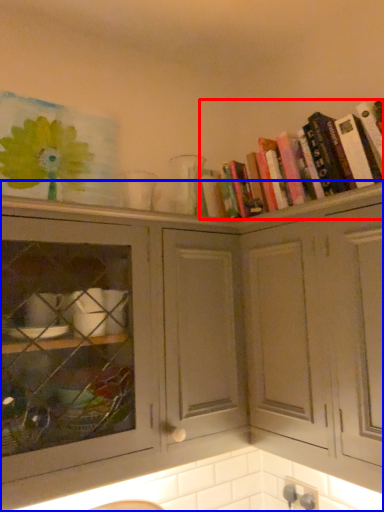
Question: Among these objects, which one is farthest to the camera, book (highlighted by a red box) or cabinetry (highlighted by a blue box)?

Choices:
 (A) book
 (B) cabinetry

Answer: (A)